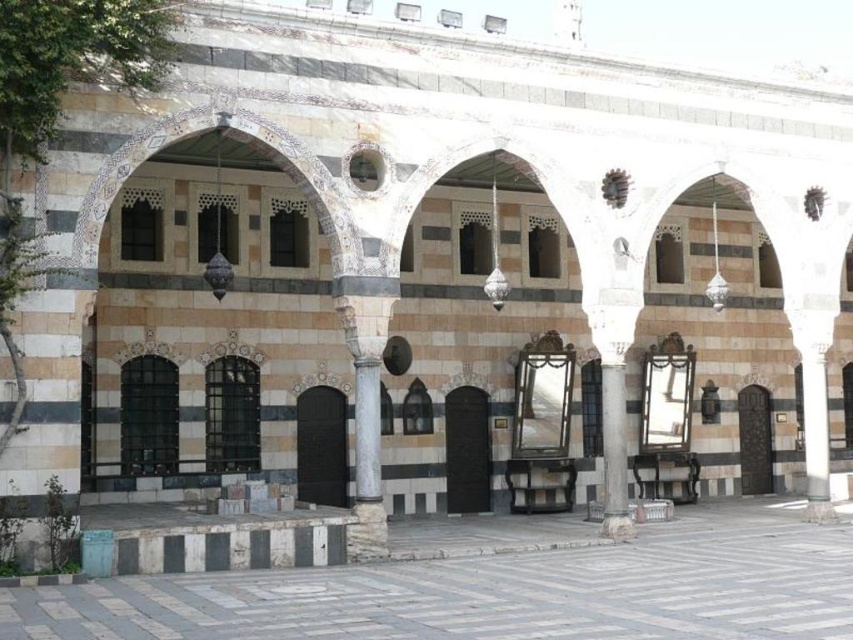
Question: Can you confirm if marble tiles at center is positioned to the right of smooth gray column at center?

Choices:
 (A) yes
 (B) no

Answer: (B)

Question: Which point is closer to the camera?

Choices:
 (A) smooth gray column at center
 (B) marble tiles at center

Answer: (B)

Question: Can you confirm if marble tiles at center is positioned above smooth gray column at center?

Choices:
 (A) yes
 (B) no

Answer: (B)

Question: Among these objects, which one is farthest from the camera?

Choices:
 (A) smooth gray column at center
 (B) marble tiles at center

Answer: (A)

Question: Is marble tiles at center bigger than smooth gray column at center?

Choices:
 (A) yes
 (B) no

Answer: (A)

Question: Which object appears closest to the camera in this image?

Choices:
 (A) marble tiles at center
 (B) smooth gray column at center

Answer: (A)